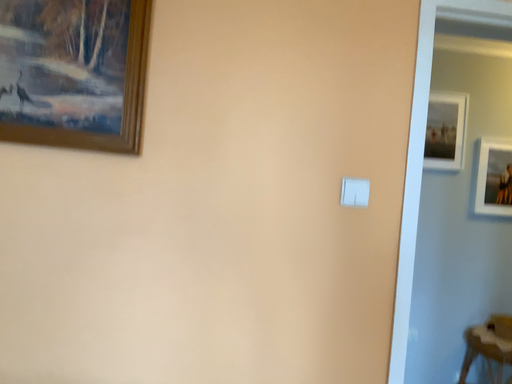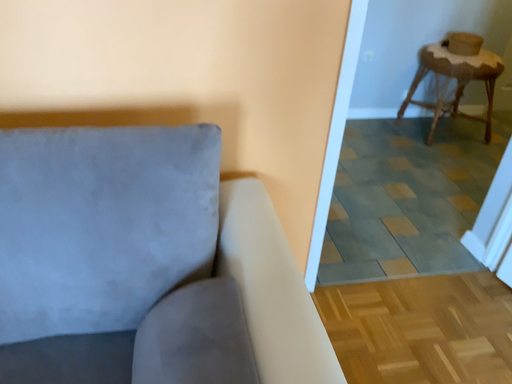
Question: Which way did the camera rotate in the video?

Choices:
 (A) rotated downward
 (B) rotated upward

Answer: (A)